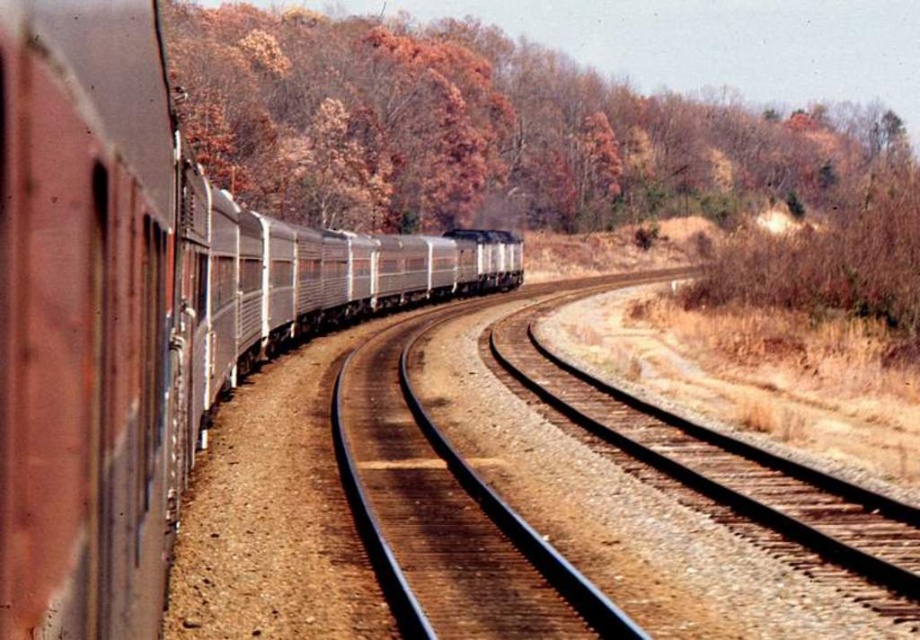
Is silver metallic train at left further to camera compared to brown leafy trees at upper center?

No, silver metallic train at left is closer to the viewer.

Is point (31, 419) closer to viewer compared to point (466, 148)?

Yes, point (31, 419) is in front of point (466, 148).

At what (x,y) coordinates should I click in order to perform the action: click on silver metallic train at left. Please return your answer as a coordinate pair (x, y). The image size is (920, 640). Looking at the image, I should click on (140, 310).

Which is more to the right, metal/smooth track at center or brown leafy trees at upper center?

From the viewer's perspective, brown leafy trees at upper center appears more on the right side.

Can you confirm if metal/smooth track at center is wider than brown leafy trees at upper center?

No.

Locate an element on the screen. The width and height of the screenshot is (920, 640). metal/smooth track at center is located at coordinates (585, 500).

Is silver metallic train at left taller than metal/smooth track at center?

Yes.

Can you confirm if silver metallic train at left is positioned above metal/smooth track at center?

Correct, silver metallic train at left is located above metal/smooth track at center.

Does point (127, 490) come closer to viewer compared to point (491, 470)?

Yes.

Identify the location of silver metallic train at left. (140, 310).